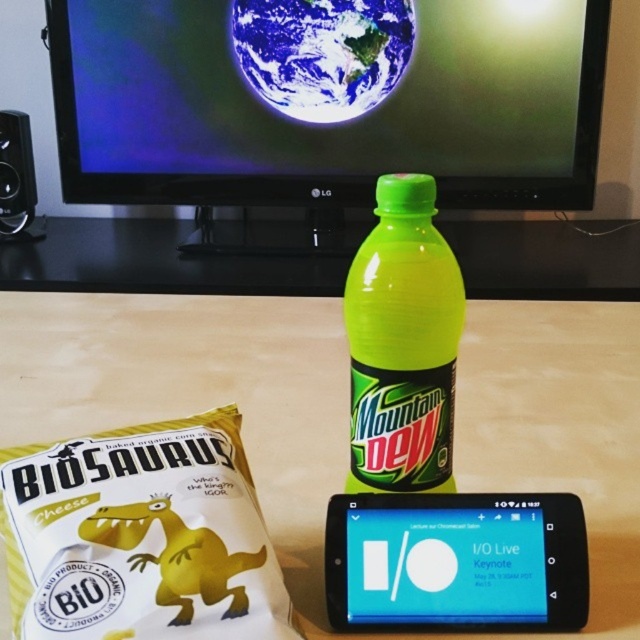
Question: Is white matte cheese at lower left above blue glossy smartphone at center?

Choices:
 (A) yes
 (B) no

Answer: (A)

Question: Which object is closer to the camera taking this photo?

Choices:
 (A) green plastic bottle at center
 (B) blue glossy smartphone at center

Answer: (A)

Question: Is matte plastic table at center positioned at the back of black plastic speaker at left?

Choices:
 (A) yes
 (B) no

Answer: (B)

Question: Which of the following is the closest to the observer?

Choices:
 (A) (449, 340)
 (B) (484, 74)
 (C) (4, 164)

Answer: (A)

Question: Which of the following is the closest to the observer?

Choices:
 (A) (515, 516)
 (B) (164, 176)

Answer: (A)

Question: Is matte black monitor at upper center to the left of green plastic bottle at center from the viewer's perspective?

Choices:
 (A) yes
 (B) no

Answer: (A)